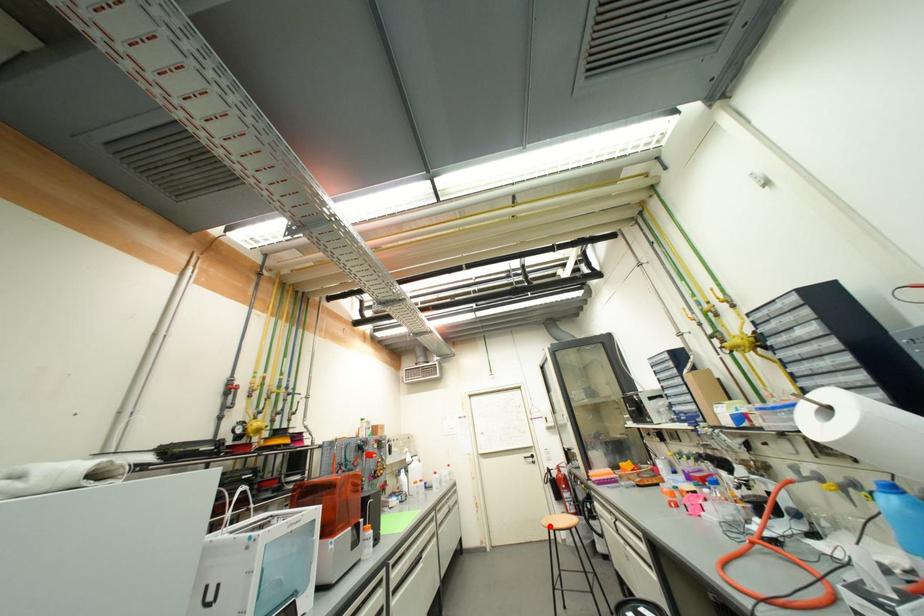
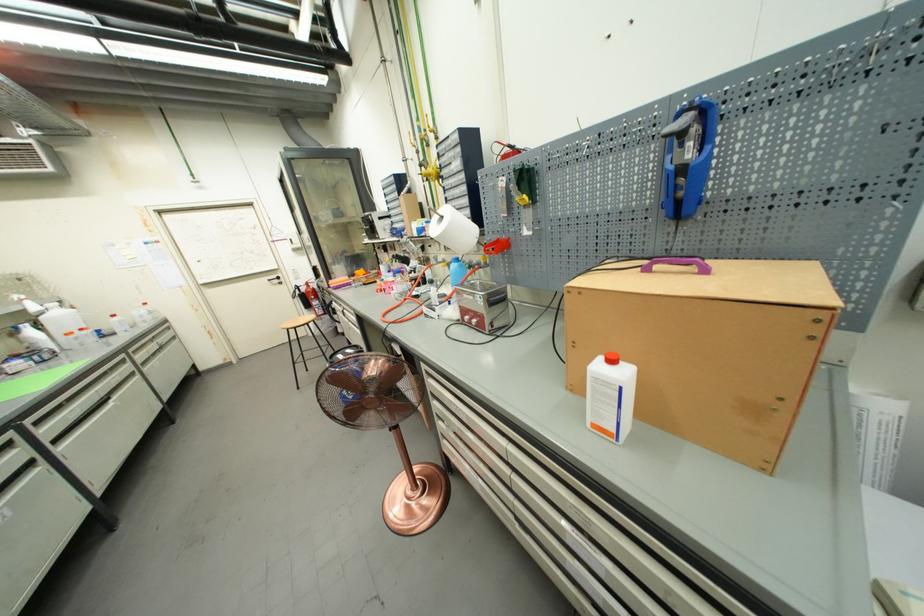
Question: I am providing you with two images of the same scene from different viewpoints. In image1, a red point is highlighted. Considering the same 3D point in image2, which of the following is correct?

Choices:
 (A) It is closer
 (B) It is farther

Answer: (A)